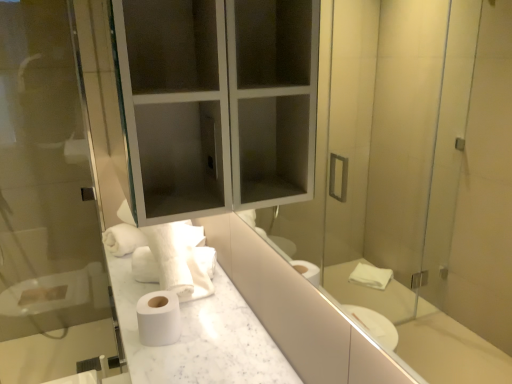
Question: Which is correct: matte glass medicine cabinet at upper center is inside transparent glass screen door at left, or outside of it?

Choices:
 (A) inside
 (B) outside

Answer: (B)

Question: Is point (150, 46) closer or farther from the camera than point (51, 46)?

Choices:
 (A) farther
 (B) closer

Answer: (B)

Question: Which object is positioned farthest from the white marble countertop at center?

Choices:
 (A) transparent glass screen door at left
 (B) matte glass medicine cabinet at upper center
 (C) white matte toilet paper at center

Answer: (A)

Question: Based on their relative distances, which object is nearer to the transparent glass screen door at left?

Choices:
 (A) white matte toilet paper at center
 (B) white marble countertop at center
 (C) matte glass medicine cabinet at upper center

Answer: (C)